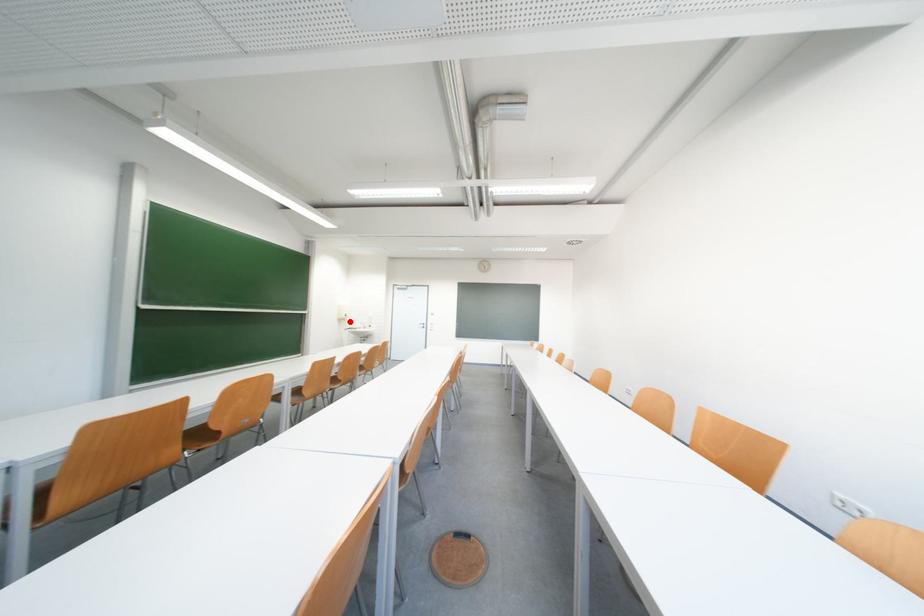
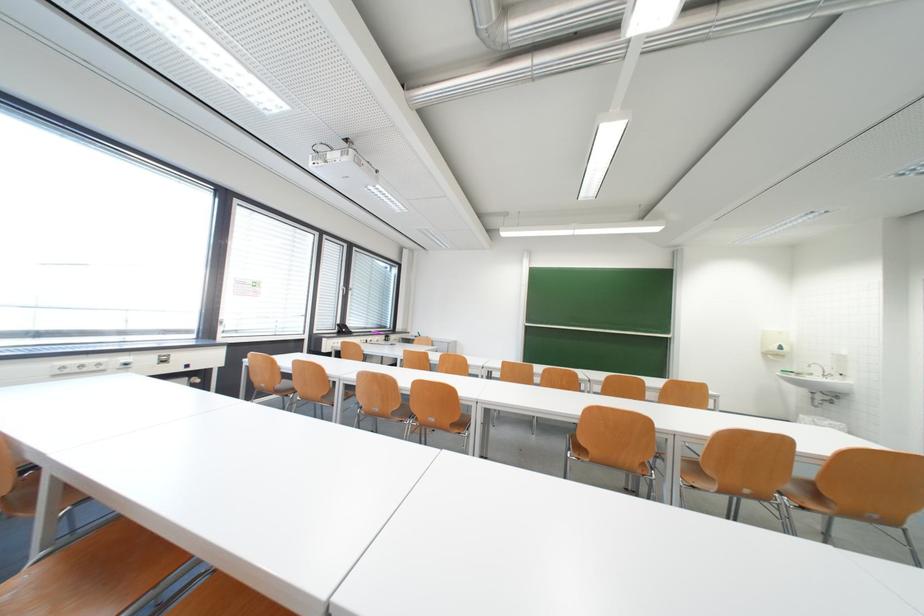
Locate, in the second image, the point that corresponds to the highlighted location in the first image.

(784, 357)